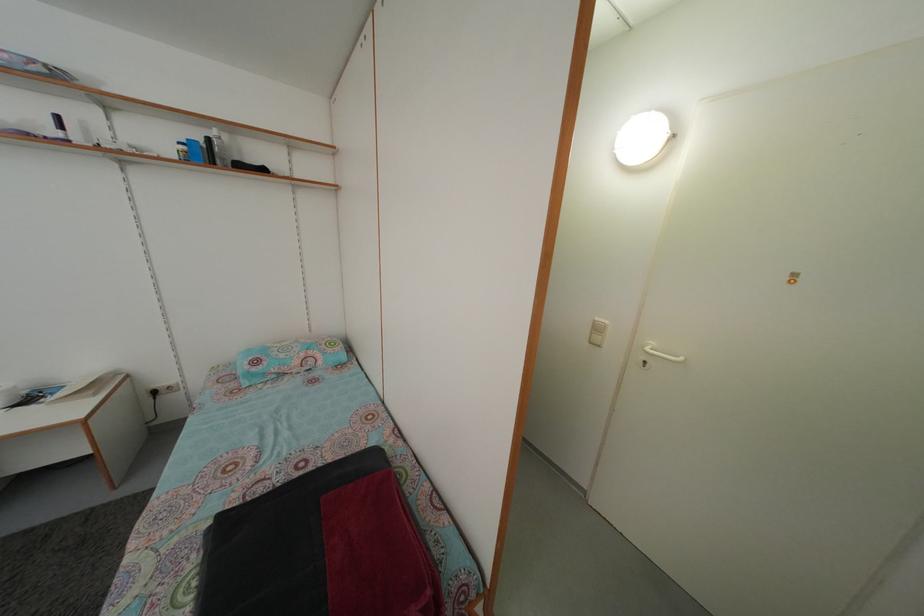
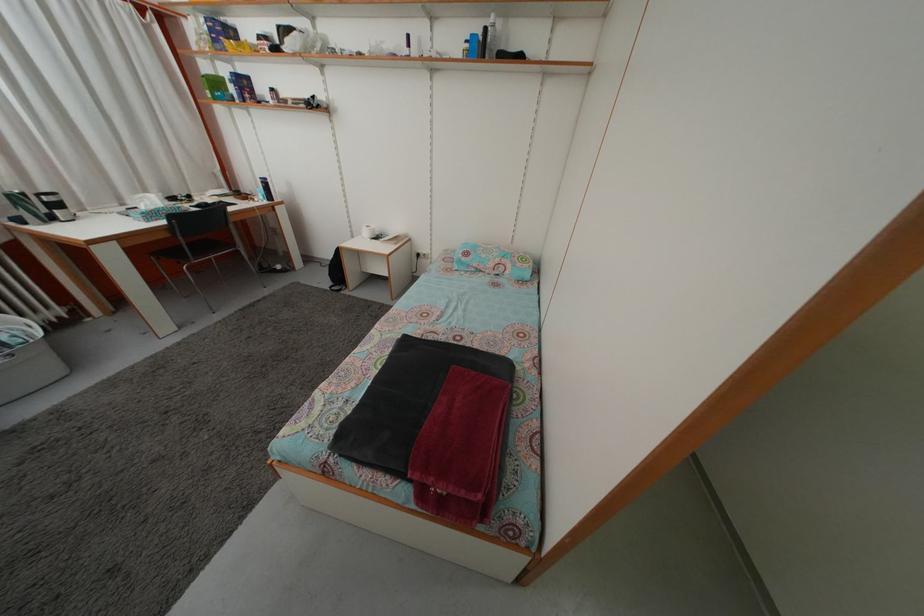
Where in the second image is the point corresponding to pixel 214 148 from the first image?

(492, 38)